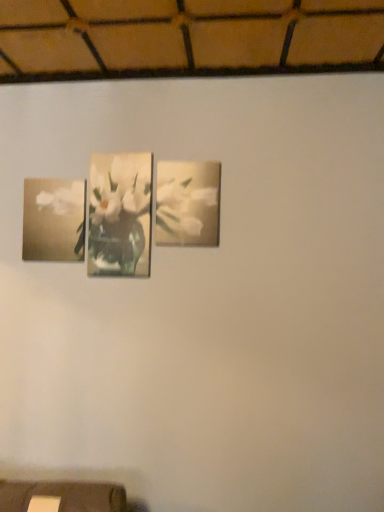
Question: From the image's perspective, is matte floral print at center, which is the 2th picture frame from left to right, located beneath matte floral print at center?

Choices:
 (A) yes
 (B) no

Answer: (B)

Question: Does matte floral print at center, which is the 2th picture frame from left to right, have a lesser width compared to matte floral print at center?

Choices:
 (A) yes
 (B) no

Answer: (B)

Question: From a real-world perspective, is matte floral print at center, which is the 2th picture frame from left to right, beneath matte floral print at center?

Choices:
 (A) no
 (B) yes

Answer: (A)

Question: From a real-world perspective, is matte floral print at center, the first picture frame from the right, positioned over matte floral print at center based on gravity?

Choices:
 (A) yes
 (B) no

Answer: (A)

Question: Is matte floral print at center, which is the 2th picture frame from left to right, looking in the opposite direction of matte floral print at center?

Choices:
 (A) yes
 (B) no

Answer: (B)

Question: Considering the relative sizes of matte floral print at center, which is the 2th picture frame from left to right, and matte floral print at center in the image provided, is matte floral print at center, which is the 2th picture frame from left to right, shorter than matte floral print at center?

Choices:
 (A) yes
 (B) no

Answer: (A)

Question: Are matte floral print at center and matte floral print at left, which is the 1th picture frame in left-to-right order, beside each other?

Choices:
 (A) yes
 (B) no

Answer: (B)

Question: Is matte floral print at center to the right of matte floral print at left, which is the 1th picture frame in left-to-right order, from the viewer's perspective?

Choices:
 (A) yes
 (B) no

Answer: (A)

Question: From a real-world perspective, is matte floral print at center positioned under matte floral print at left, placed as the 2th picture frame when sorted from right to left, based on gravity?

Choices:
 (A) yes
 (B) no

Answer: (B)

Question: Is the position of matte floral print at center more distant than that of matte floral print at left, which is the 1th picture frame in left-to-right order?

Choices:
 (A) no
 (B) yes

Answer: (A)

Question: From the image's perspective, does matte floral print at center appear higher than matte floral print at left, which is the 1th picture frame in left-to-right order?

Choices:
 (A) no
 (B) yes

Answer: (B)

Question: From the image's perspective, is matte floral print at center below matte floral print at left, which is the 1th picture frame in left-to-right order?

Choices:
 (A) no
 (B) yes

Answer: (A)

Question: Can you confirm if matte floral print at center, the first picture frame from the right, is smaller than matte floral print at left, placed as the 2th picture frame when sorted from right to left?

Choices:
 (A) yes
 (B) no

Answer: (A)